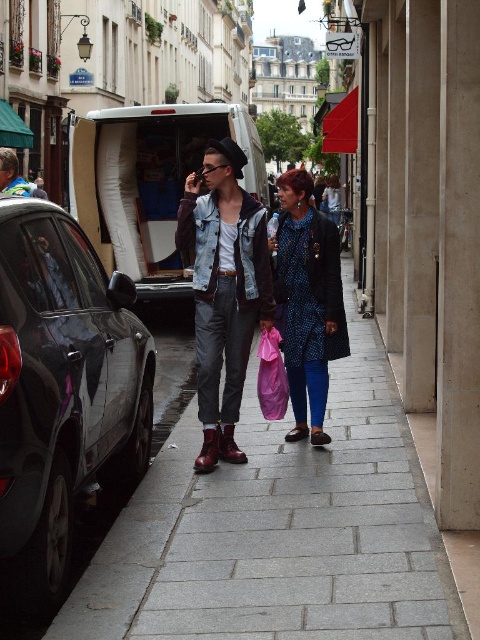
Question: Which point is farther to the camera?

Choices:
 (A) (304, 189)
 (B) (223, 403)

Answer: (A)

Question: Which point appears closest to the camera in this image?

Choices:
 (A) (96, 596)
 (B) (123, 321)
 (C) (230, 324)
 (D) (188, 129)

Answer: (A)

Question: Which point appears closest to the camera in this image?

Choices:
 (A) (203, 408)
 (B) (94, 416)
 (C) (372, 429)

Answer: (B)

Question: Is shiny black car at left smaller than blue dotted dress at center?

Choices:
 (A) yes
 (B) no

Answer: (A)

Question: Can you confirm if gray stone pavement at center is positioned below shiny black car at left?

Choices:
 (A) no
 (B) yes

Answer: (B)

Question: Does shiny black car at left come in front of white matte van at center?

Choices:
 (A) yes
 (B) no

Answer: (A)